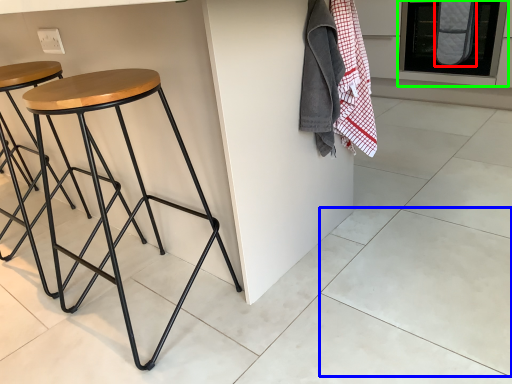
Question: Estimate the real-world distances between objects in this image. Which object is closer to blanket (highlighted by a red box), tile (highlighted by a blue box) or oven (highlighted by a green box)?

Choices:
 (A) tile
 (B) oven

Answer: (B)